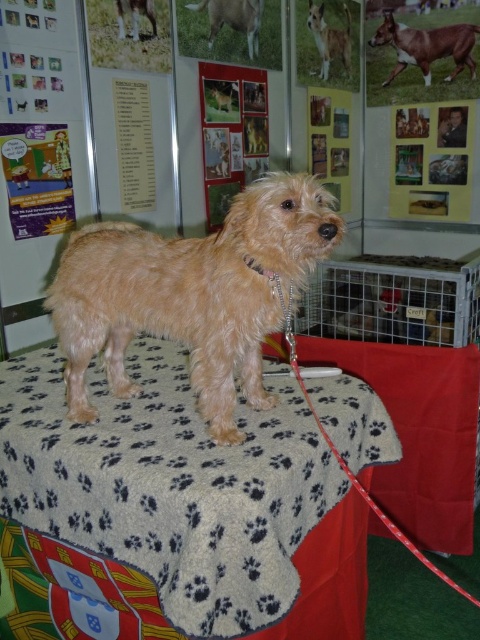
You are a photographer at a pet event and need to capture a closeup of the gray paw print fabric at center and the paw print fabric table at center. Which one is higher in the image?

The gray paw print fabric at center is located above the paw print fabric table at center, so it is higher in the image.

You are a photographer setting up for a pet photoshoot. You need to place a small dog on the gray paw print fabric at center and the paw print fabric table at center. Which object should you choose to ensure the dog has more space to move around?

The gray paw print fabric at center has a greater width than the paw print fabric table at center, so placing the dog on the gray paw print fabric at center would provide more space for movement.

You are a photographer taking a picture of the gray paw print fabric at center and the light brown fur at upper right. Which object should you focus on first if you want to capture both in sharp focus? Please explain your reasoning based on their sizes and positions.

The gray paw print fabric at center is larger in size than the light brown fur at upper right. To capture both in sharp focus, you should focus on the gray paw print fabric at center first because larger objects often require more precise focus to ensure all details are clear, especially when they are centrally positioned.